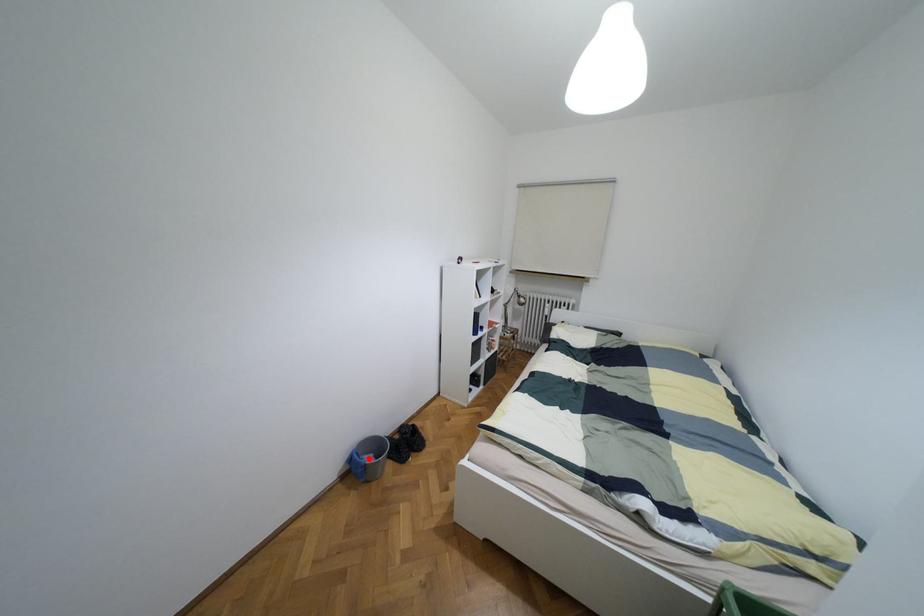
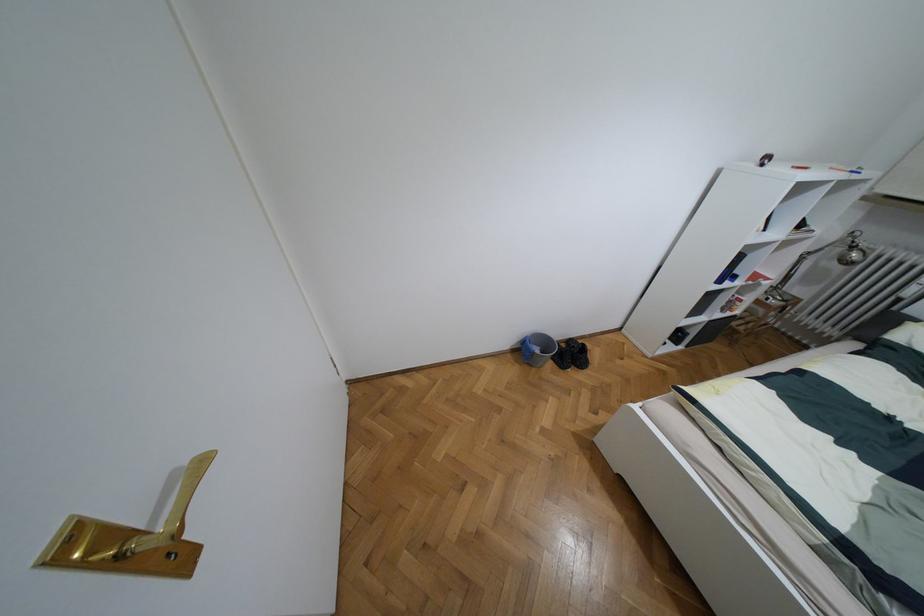
Question: I am providing you with two images of the same scene from different viewpoints. A red point is marked on the first image. Is the red point's position out of view in image 2?

Choices:
 (A) Yes
 (B) No

Answer: (B)